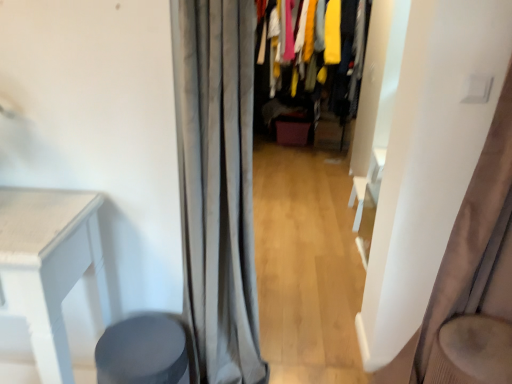
Question: Considering the relative positions of velvet fabric clothes at center and matte gray stool at lower left in the image provided, is velvet fabric clothes at center behind matte gray stool at lower left?

Choices:
 (A) no
 (B) yes

Answer: (B)

Question: Does velvet fabric clothes at center lie in front of matte gray stool at lower left?

Choices:
 (A) no
 (B) yes

Answer: (A)

Question: Are velvet fabric clothes at center and matte gray stool at lower left located far from each other?

Choices:
 (A) no
 (B) yes

Answer: (B)

Question: Would you say velvet fabric clothes at center contains matte gray stool at lower left?

Choices:
 (A) yes
 (B) no

Answer: (B)

Question: Is velvet fabric clothes at center to the left of matte gray stool at lower left from the viewer's perspective?

Choices:
 (A) yes
 (B) no

Answer: (B)

Question: Is velvet fabric clothes at center completely or partially outside of matte gray stool at lower left?

Choices:
 (A) yes
 (B) no

Answer: (A)

Question: Is gray fabric curtain at center, which is the first curtain from left to right, aimed at velvet fabric clothes at center?

Choices:
 (A) yes
 (B) no

Answer: (B)

Question: Is gray fabric curtain at center, which is the 2th curtain in right-to-left order, positioned beyond the bounds of velvet fabric clothes at center?

Choices:
 (A) no
 (B) yes

Answer: (B)

Question: Is gray fabric curtain at center, which is the first curtain from left to right, at the right side of velvet fabric clothes at center?

Choices:
 (A) yes
 (B) no

Answer: (B)

Question: Is there a large distance between gray fabric curtain at center, which is the first curtain from left to right, and velvet fabric clothes at center?

Choices:
 (A) yes
 (B) no

Answer: (A)

Question: From a real-world perspective, is gray fabric curtain at center, which is the first curtain from left to right, on velvet fabric clothes at center?

Choices:
 (A) yes
 (B) no

Answer: (B)

Question: Does gray fabric curtain at center, which is the 2th curtain in right-to-left order, have a greater height compared to velvet fabric clothes at center?

Choices:
 (A) yes
 (B) no

Answer: (A)

Question: Considering the relative positions of velvet fabric clothes at center and gray fabric curtain at center, which is the first curtain from left to right, in the image provided, is velvet fabric clothes at center behind gray fabric curtain at center, which is the first curtain from left to right,?

Choices:
 (A) no
 (B) yes

Answer: (B)